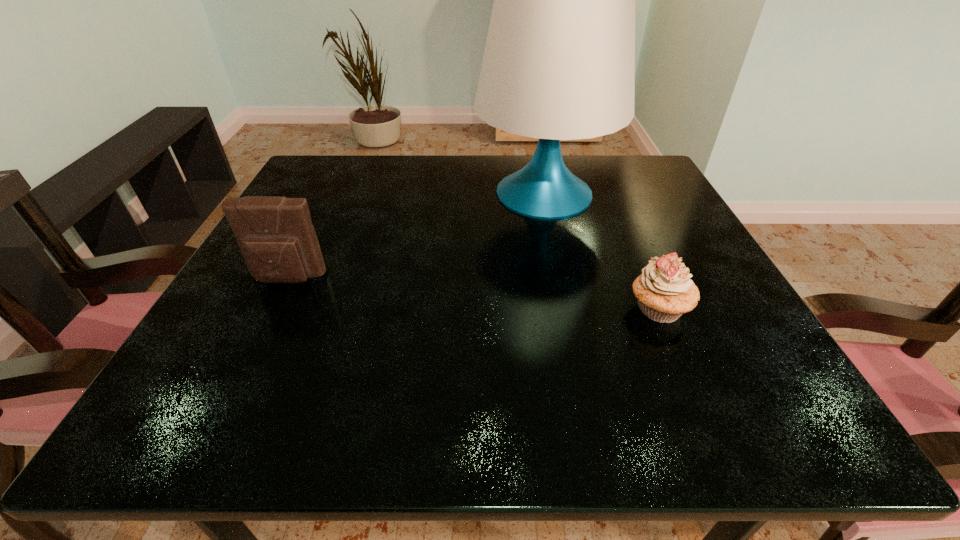
At what (x,y) coordinates should I click in order to perform the action: click on vacant space that satisfies the following two spatial constraints: 1. on the front-facing side of the cupcake; 2. on the left side of the farthest object. Please return your answer as a coordinate pair (x, y). This screenshot has height=540, width=960. Looking at the image, I should click on (568, 309).

The image size is (960, 540). I want to click on vacant space that satisfies the following two spatial constraints: 1. with an open flap on the shortest object; 2. on the right side of the second farthest object, so click(273, 309).